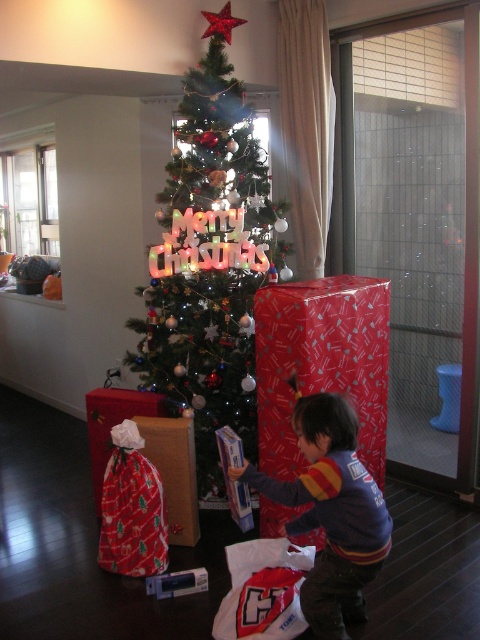
Question: Among these objects, which one is farthest from the camera?

Choices:
 (A) striped sweater at lower center
 (B) shiny green christmas tree at center

Answer: (B)

Question: Is shiny green christmas tree at center to the left of striped sweater at lower center from the viewer's perspective?

Choices:
 (A) yes
 (B) no

Answer: (A)

Question: Among these points, which one is nearest to the camera?

Choices:
 (A) (231, 170)
 (B) (354, 560)

Answer: (B)

Question: Does shiny green christmas tree at center appear over striped sweater at lower center?

Choices:
 (A) no
 (B) yes

Answer: (B)

Question: Is shiny green christmas tree at center positioned in front of striped sweater at lower center?

Choices:
 (A) no
 (B) yes

Answer: (A)